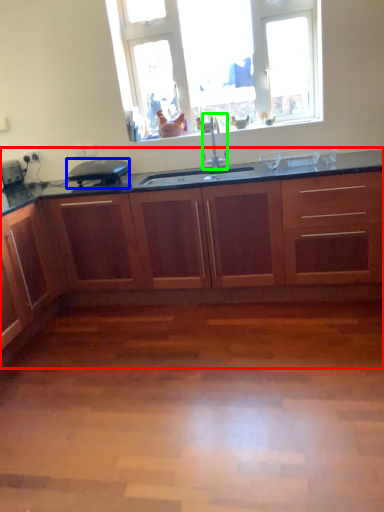
Question: Which object is positioned closest to cabinetry (highlighted by a red box)? Select from appliance (highlighted by a blue box) and faucet (highlighted by a green box).

Choices:
 (A) appliance
 (B) faucet

Answer: (A)